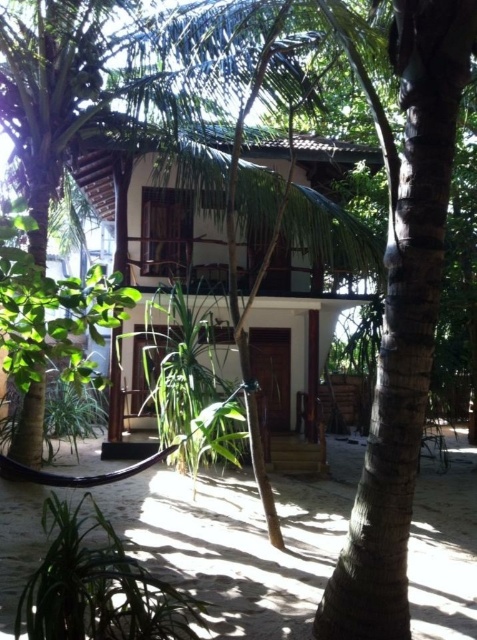
You are standing at the point marked by the coordinates point [164,195] in the image, which is located at the white wood house at center. From this position, which direction should you face to see the large open door on the ground floor of the white wood house at center?

The large open door is on the ground floor of the white wood house at center. Since you are standing at the point indicating the house at center, you should face towards the lower part of the image to see the door.

You are a visitor approaching the white wood house at center and the green leafy plant at lower left. Which object would appear larger to you as you walk towards them?

The white wood house at center would appear larger to you since it is bigger than the green leafy plant at lower left according to the description.

You are a drone operator trying to capture aerial footage of the white wood house at center and the green leafy plant at lower left. Since the drone has a limited flight height, you need to know which object is taller to avoid collision. Which one is taller?

The white wood house at center is taller than the green leafy plant at lower left, so the drone should avoid flying above the white wood house at center to prevent collision.